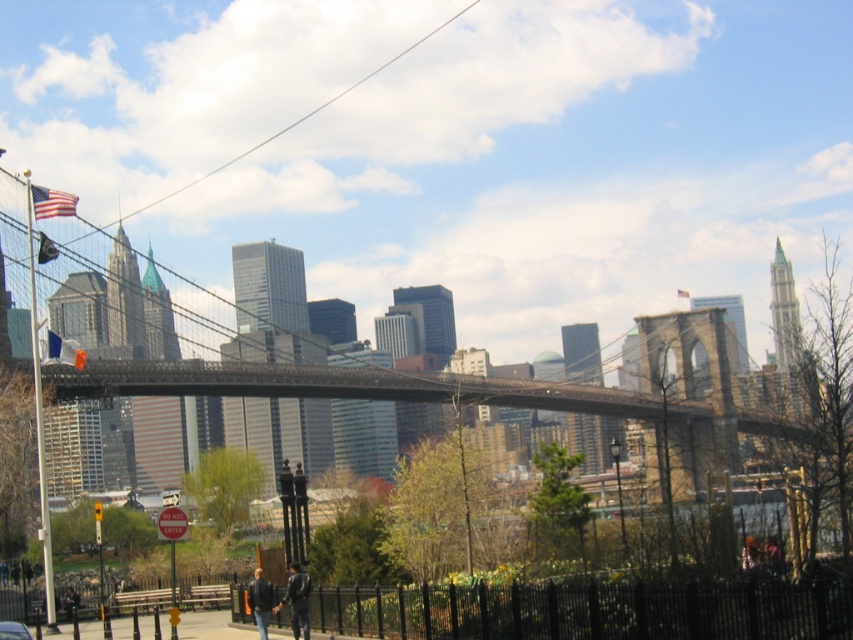
Question: Among these objects, which one is nearest to the camera?

Choices:
 (A) metallic gray suspension bridge at center
 (B) metallic silver car at lower left

Answer: (B)

Question: Does metallic gray suspension bridge at center have a lesser width compared to metallic silver car at lower left?

Choices:
 (A) no
 (B) yes

Answer: (A)

Question: Which object appears farthest from the camera in this image?

Choices:
 (A) metallic silver car at lower left
 (B) metallic gray suspension bridge at center

Answer: (B)

Question: Is metallic gray suspension bridge at center further to camera compared to metallic silver car at lower left?

Choices:
 (A) no
 (B) yes

Answer: (B)

Question: Observing the image, what is the correct spatial positioning of metallic gray suspension bridge at center in reference to metallic silver car at lower left?

Choices:
 (A) left
 (B) right

Answer: (B)